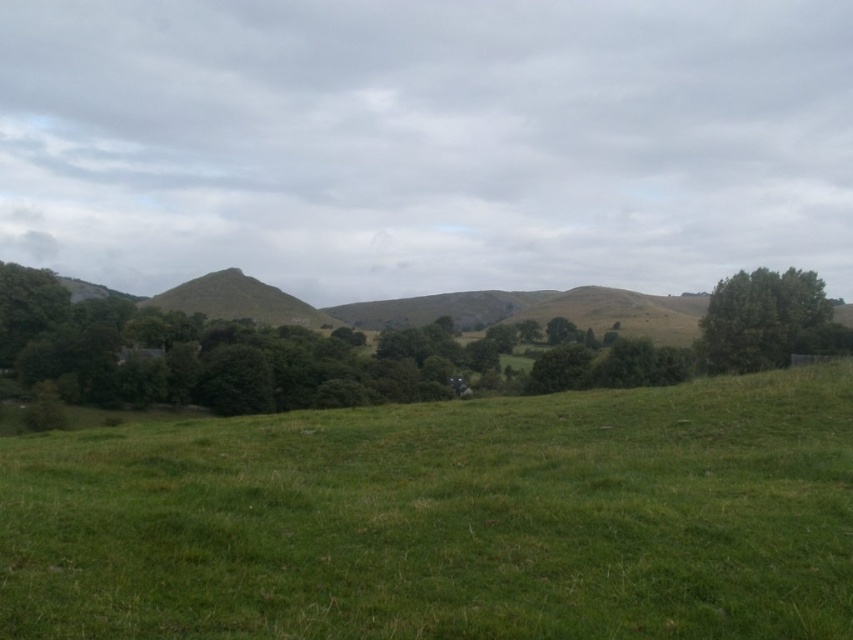
Question: Among these points, which one is nearest to the camera?

Choices:
 (A) (840, 337)
 (B) (788, 600)

Answer: (B)

Question: Is green grassy field at center thinner than green leafy tree at right?

Choices:
 (A) no
 (B) yes

Answer: (B)

Question: Can you confirm if green grassy field at center is smaller than green leafy tree at right?

Choices:
 (A) no
 (B) yes

Answer: (B)

Question: Which point is closer to the camera?

Choices:
 (A) green grassy field at center
 (B) green leafy tree at right

Answer: (A)

Question: Does green grassy field at center come in front of green leafy tree at right?

Choices:
 (A) no
 (B) yes

Answer: (B)